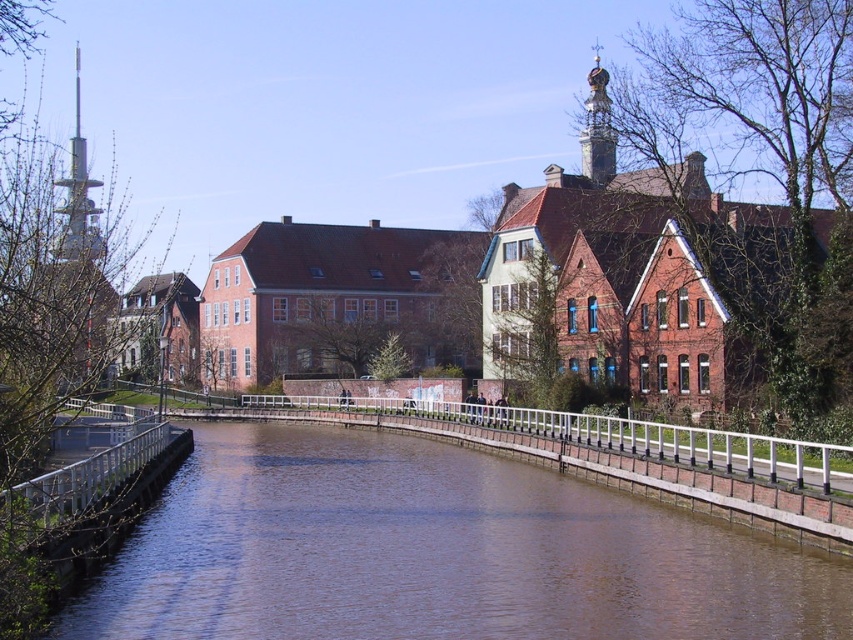
Is the position of brown smooth water at center less distant than that of gold ornate tower at upper center?

Yes, it is.

How distant is brown smooth water at center from gold ornate tower at upper center?

The distance of brown smooth water at center from gold ornate tower at upper center is 93.35 meters.

What are the coordinates of `brown smooth water at center` in the screenshot? It's located at (434, 552).

The height and width of the screenshot is (640, 853). What are the coordinates of `brown smooth water at center` in the screenshot? It's located at (434, 552).

Between point (775, 582) and point (74, 209), which one is positioned behind?

Positioned behind is point (74, 209).

Does point (396, 435) lie in front of point (77, 64)?

Yes, point (396, 435) is closer to viewer.

What are the coordinates of `brown smooth water at center` in the screenshot? It's located at (434, 552).

Is brushed metal tower at left below gold ornate tower at upper center?

Indeed, brushed metal tower at left is positioned under gold ornate tower at upper center.

Consider the image. Between brushed metal tower at left and gold ornate tower at upper center, which one appears on the left side from the viewer's perspective?

brushed metal tower at left is more to the left.

Which is in front, point (96, 250) or point (595, 124)?

Point (96, 250) is more forward.

This screenshot has width=853, height=640. What are the coordinates of `brushed metal tower at left` in the screenshot? It's located at (79, 195).